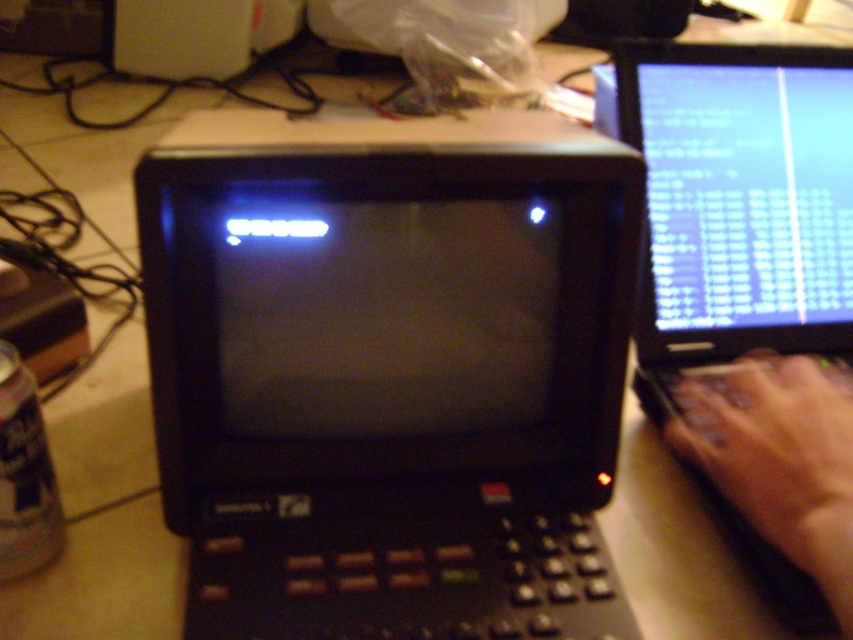
You are setting up a new desk and need to place a keyboard. The black plastic monitor at center is located at point 0.584, 0.456. Where should you place the keyboard relative to the monitor to ensure it is within reach?

The keyboard should be placed below the black plastic monitor at center, as this is the standard position for easy access and operation.

You are a technician trying to connect two points in the workspace. The first point is at coordinate point(376, 220) and the second is at point(810, 490). Based on the scene description, which point is closer to the viewer?

Point(810, 490) is closer to the viewer because it is in front of point(376, 220) according to the description.

You are a technician who needs to connect a USB cable from the black plastic monitor at center to the matte skin hand at right. The cable you have is 8 inches long. Will it reach?

The black plastic monitor at center and matte skin hand at right are 8.64 inches apart. The cable is 8 inches long, which is shorter than the required distance. Therefore, the cable will not reach.